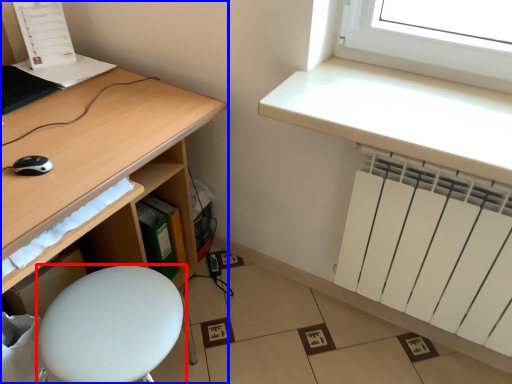
Question: Which of the following is the closest to the observer, furniture (highlighted by a red box) or desk (highlighted by a blue box)?

Choices:
 (A) furniture
 (B) desk

Answer: (B)